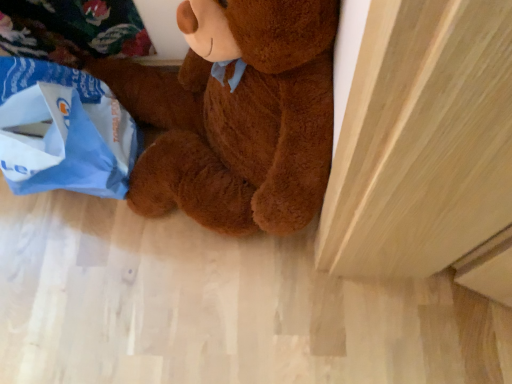
Describe the element at coordinates (64, 131) in the screenshot. I see `blue paper grocery bag at lower left` at that location.

In order to click on blue paper grocery bag at lower left in this screenshot , I will do `click(64, 131)`.

This screenshot has width=512, height=384. What do you see at coordinates (238, 122) in the screenshot?
I see `brown plush teddy bear at center` at bounding box center [238, 122].

At what (x,y) coordinates should I click in order to perform the action: click on brown plush teddy bear at center. Please return your answer as a coordinate pair (x, y). Looking at the image, I should click on (238, 122).

The image size is (512, 384). Find the location of `blue paper grocery bag at lower left`. blue paper grocery bag at lower left is located at coordinates (64, 131).

From the picture: Is brown plush teddy bear at center at the left side of blue paper grocery bag at lower left?

In fact, brown plush teddy bear at center is to the right of blue paper grocery bag at lower left.

Based on the photo, considering the positions of objects brown plush teddy bear at center and blue paper grocery bag at lower left in the image provided, who is in front, brown plush teddy bear at center or blue paper grocery bag at lower left?

brown plush teddy bear at center is closer to the camera.

Is point (188, 206) in front of point (21, 135)?

No.

From the image's perspective, does brown plush teddy bear at center appear lower than blue paper grocery bag at lower left?

No, from the image's perspective, brown plush teddy bear at center is not below blue paper grocery bag at lower left.

From a real-world perspective, which is physically below, brown plush teddy bear at center or blue paper grocery bag at lower left?

blue paper grocery bag at lower left, from a real-world perspective.

Does brown plush teddy bear at center have a greater width compared to blue paper grocery bag at lower left?

Indeed, brown plush teddy bear at center has a greater width compared to blue paper grocery bag at lower left.

Considering the sizes of objects brown plush teddy bear at center and blue paper grocery bag at lower left in the image provided, who is taller, brown plush teddy bear at center or blue paper grocery bag at lower left?

With more height is brown plush teddy bear at center.

Does brown plush teddy bear at center have a larger size compared to blue paper grocery bag at lower left?

Yes, brown plush teddy bear at center is bigger than blue paper grocery bag at lower left.

Could blue paper grocery bag at lower left be considered to be inside brown plush teddy bear at center?

Definitely not — blue paper grocery bag at lower left is not inside brown plush teddy bear at center.

Are brown plush teddy bear at center and blue paper grocery bag at lower left making contact?

There is a gap between brown plush teddy bear at center and blue paper grocery bag at lower left.

Is brown plush teddy bear at center oriented away from blue paper grocery bag at lower left?

No.

Can you tell me how much brown plush teddy bear at center and blue paper grocery bag at lower left differ in facing direction?

There is a 3.14e-05-degree angle between the facing directions of brown plush teddy bear at center and blue paper grocery bag at lower left.

Measure the distance from brown plush teddy bear at center to blue paper grocery bag at lower left.

brown plush teddy bear at center and blue paper grocery bag at lower left are 19.79 centimeters apart from each other.

At what (x,y) coordinates should I click in order to perform the action: click on teddy bear lying above the blue paper grocery bag at lower left (from the image's perspective). Please return your answer as a coordinate pair (x, y). This screenshot has width=512, height=384. Looking at the image, I should click on (238, 122).

Does blue paper grocery bag at lower left appear on the right side of brown plush teddy bear at center?

No.

Is the position of blue paper grocery bag at lower left more distant than that of brown plush teddy bear at center?

That is True.

Considering the points (89, 109) and (288, 130), which point is behind, point (89, 109) or point (288, 130)?

Point (89, 109)

From the image's perspective, which one is positioned higher, blue paper grocery bag at lower left or brown plush teddy bear at center?

brown plush teddy bear at center.

From a real-world perspective, is blue paper grocery bag at lower left beneath brown plush teddy bear at center?

Yes, from a real-world perspective, blue paper grocery bag at lower left is beneath brown plush teddy bear at center.

Between blue paper grocery bag at lower left and brown plush teddy bear at center, which one has larger width?

Wider between the two is brown plush teddy bear at center.

Who is shorter, blue paper grocery bag at lower left or brown plush teddy bear at center?

Standing shorter between the two is blue paper grocery bag at lower left.

Considering the sizes of objects blue paper grocery bag at lower left and brown plush teddy bear at center in the image provided, who is bigger, blue paper grocery bag at lower left or brown plush teddy bear at center?

brown plush teddy bear at center.

Would you say blue paper grocery bag at lower left is inside or outside brown plush teddy bear at center?

blue paper grocery bag at lower left cannot be found inside brown plush teddy bear at center.

Is blue paper grocery bag at lower left far from brown plush teddy bear at center?

No.

Is blue paper grocery bag at lower left positioned with its back to brown plush teddy bear at center?

No, blue paper grocery bag at lower left's orientation is not away from brown plush teddy bear at center.

What's the angular difference between blue paper grocery bag at lower left and brown plush teddy bear at center's facing directions?

The facing directions of blue paper grocery bag at lower left and brown plush teddy bear at center are 3.14e-05 degrees apart.

How distant is blue paper grocery bag at lower left from brown plush teddy bear at center?

19.79 centimeters.

I want to click on teddy bear that is on the right side of blue paper grocery bag at lower left, so click(238, 122).

Image resolution: width=512 pixels, height=384 pixels. Identify the location of grocery bag that is below the brown plush teddy bear at center (from the image's perspective). (64, 131).

Where is `grocery bag located behind the brown plush teddy bear at center`? grocery bag located behind the brown plush teddy bear at center is located at coordinates click(64, 131).